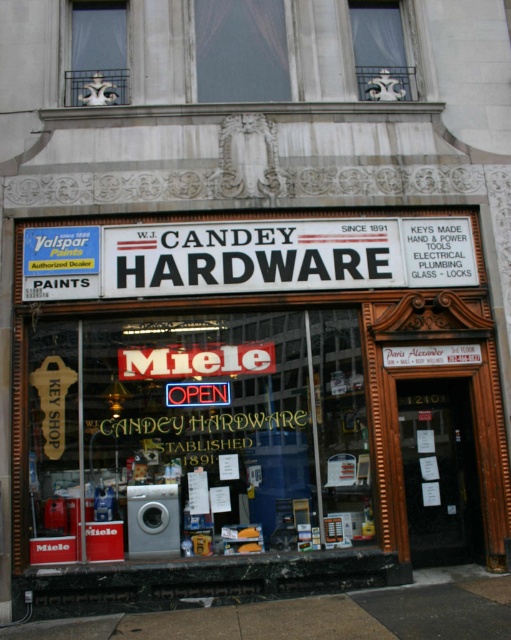
Question: Does transparent glass window at center have a greater width compared to white/black sign at center?

Choices:
 (A) no
 (B) yes

Answer: (A)

Question: Does transparent glass window at center appear on the right side of white/black sign at center?

Choices:
 (A) no
 (B) yes

Answer: (A)

Question: Among these points, which one is nearest to the camera?

Choices:
 (A) (135, 346)
 (B) (181, 292)

Answer: (B)

Question: Which of the following is the farthest from the observer?

Choices:
 (A) (236, 342)
 (B) (28, 280)

Answer: (A)

Question: Is transparent glass window at center thinner than white/black sign at center?

Choices:
 (A) no
 (B) yes

Answer: (B)